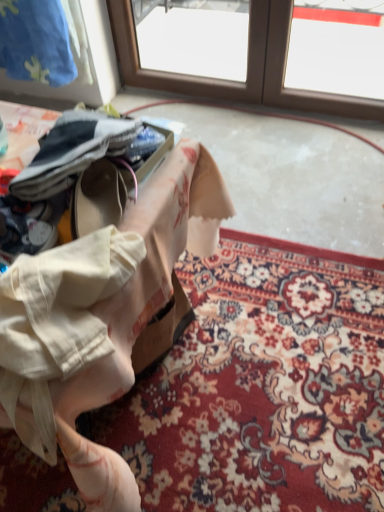
Question: Is floral fabric at center situated inside floral carpet at lower center or outside?

Choices:
 (A) inside
 (B) outside

Answer: (B)

Question: Considering the positions of floral fabric at center and floral carpet at lower center in the image, is floral fabric at center wider or thinner than floral carpet at lower center?

Choices:
 (A) thin
 (B) wide

Answer: (A)

Question: From the image's perspective, relative to floral carpet at lower center, is floral fabric at center above or below?

Choices:
 (A) below
 (B) above

Answer: (B)

Question: Considering their positions, is floral carpet at lower center located in front of or behind floral fabric at center?

Choices:
 (A) front
 (B) behind

Answer: (B)

Question: Which is correct: floral carpet at lower center is inside floral fabric at center, or outside of it?

Choices:
 (A) inside
 (B) outside

Answer: (B)

Question: From a real-world perspective, is floral carpet at lower center physically located above or below floral fabric at center?

Choices:
 (A) below
 (B) above

Answer: (A)

Question: Does point (236, 394) appear closer or farther from the camera than point (102, 402)?

Choices:
 (A) farther
 (B) closer

Answer: (A)